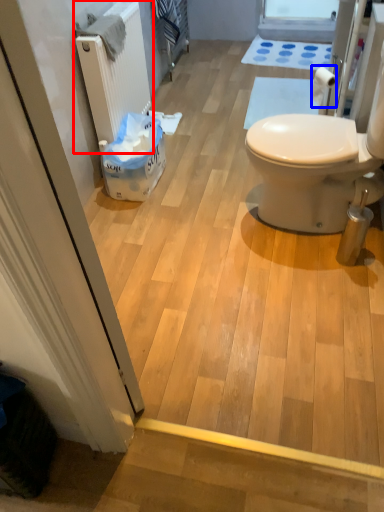
Question: Which of the following is the farthest to the observer, radiator (highlighted by a red box) or toilet paper (highlighted by a blue box)?

Choices:
 (A) radiator
 (B) toilet paper

Answer: (B)